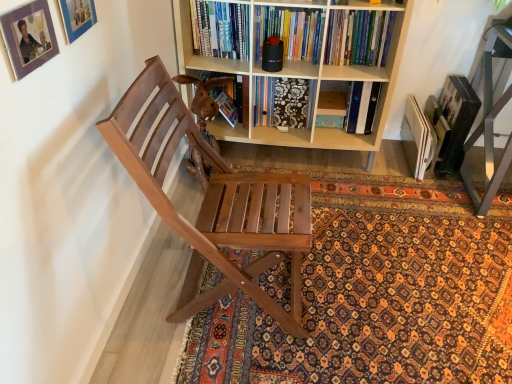
Question: Is the depth of hardcover book at upper center less than that of matte blue picture frame at upper left, the first picture frame when ordered from back to front?

Choices:
 (A) yes
 (B) no

Answer: (B)

Question: Can you confirm if hardcover book at upper center is positioned to the right of matte blue picture frame at upper left, the first picture frame when ordered from back to front?

Choices:
 (A) no
 (B) yes

Answer: (B)

Question: Is matte blue picture frame at upper left, the first picture frame when ordered from back to front, inside hardcover book at upper center?

Choices:
 (A) no
 (B) yes

Answer: (A)

Question: From a real-world perspective, is hardcover book at upper center on top of matte blue picture frame at upper left, the first picture frame when ordered from back to front?

Choices:
 (A) yes
 (B) no

Answer: (B)

Question: Considering the relative sizes of hardcover book at upper center and matte blue picture frame at upper left, the first picture frame when ordered from back to front, in the image provided, is hardcover book at upper center thinner than matte blue picture frame at upper left, the first picture frame when ordered from back to front,?

Choices:
 (A) yes
 (B) no

Answer: (B)

Question: Visually, is patterned carpet at center positioned to the left or to the right of brown wooden swivel chair at center?

Choices:
 (A) left
 (B) right

Answer: (B)

Question: Is patterned carpet at center wider or thinner than brown wooden swivel chair at center?

Choices:
 (A) wide
 (B) thin

Answer: (A)

Question: From the image's perspective, is patterned carpet at center located above or below brown wooden swivel chair at center?

Choices:
 (A) above
 (B) below

Answer: (B)

Question: From a real-world perspective, relative to brown wooden swivel chair at center, is patterned carpet at center vertically above or below?

Choices:
 (A) below
 (B) above

Answer: (A)

Question: In the image, is patterned carpet at center on the left side or the right side of wooden chair at left?

Choices:
 (A) right
 (B) left

Answer: (A)

Question: Choose the correct answer: Is patterned carpet at center inside wooden chair at left or outside it?

Choices:
 (A) outside
 (B) inside

Answer: (A)

Question: From the image's perspective, is patterned carpet at center positioned above or below wooden chair at left?

Choices:
 (A) below
 (B) above

Answer: (A)

Question: Does point (485, 238) appear closer or farther from the camera than point (223, 190)?

Choices:
 (A) farther
 (B) closer

Answer: (A)

Question: Is light wood bookcase at center bigger or smaller than matte blue picture frame at upper left, the 2th picture frame when ordered from front to back?

Choices:
 (A) small
 (B) big

Answer: (B)

Question: Is light wood bookcase at center wider or thinner than matte blue picture frame at upper left, the 2th picture frame when ordered from front to back?

Choices:
 (A) thin
 (B) wide

Answer: (B)